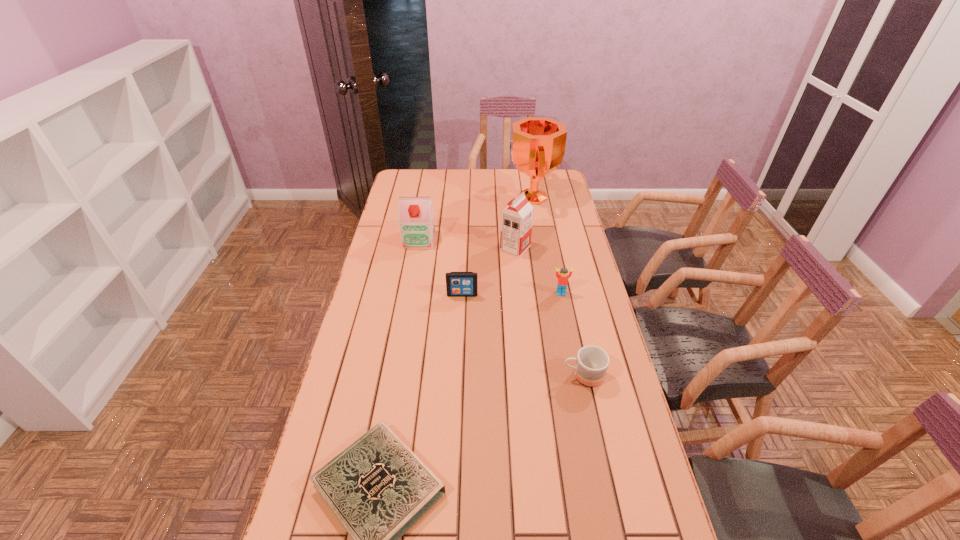
Find the location of a particular element. vacant region located 0.250m on the side of the farthest object with the star emblem is located at coordinates (455, 198).

At what (x,y) coordinates should I click in order to perform the action: click on vacant area situated on the side of the farthest object with the star emblem. Please return your answer as a coordinate pair (x, y). Image resolution: width=960 pixels, height=540 pixels. Looking at the image, I should click on (476, 198).

Locate an element on the screen. The image size is (960, 540). vacant space located 0.100m on the side of the farthest object with the star emblem is located at coordinates (486, 198).

The height and width of the screenshot is (540, 960). Find the location of `vacant area situated on the right of the taller soya milk`. vacant area situated on the right of the taller soya milk is located at coordinates (567, 248).

This screenshot has width=960, height=540. I want to click on vacant region located with the cap open on the shorter soya milk, so click(412, 279).

Where is `vacant space located on the face of the Lego`? vacant space located on the face of the Lego is located at coordinates (568, 329).

Image resolution: width=960 pixels, height=540 pixels. Identify the location of free space located 0.310m on the front screen of the iPod. (459, 367).

Image resolution: width=960 pixels, height=540 pixels. Identify the location of free space located 0.400m on the side with the handle of the mug. (428, 376).

Find the location of a particular element. The image size is (960, 540). free space located 0.370m on the side with the handle of the mug is located at coordinates (439, 376).

Where is `vacant space situated on the side with the handle of the mug`? vacant space situated on the side with the handle of the mug is located at coordinates (536, 376).